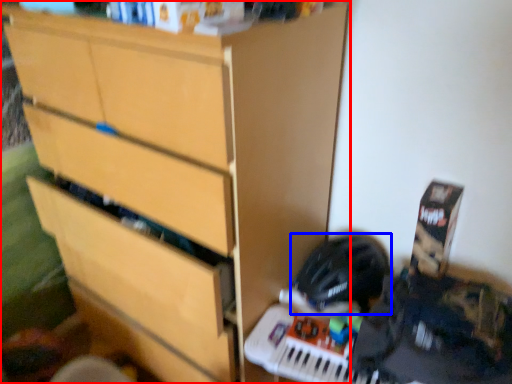
Question: Which object appears farthest to the camera in this image, chest of drawers (highlighted by a red box) or helmet (highlighted by a blue box)?

Choices:
 (A) chest of drawers
 (B) helmet

Answer: (B)